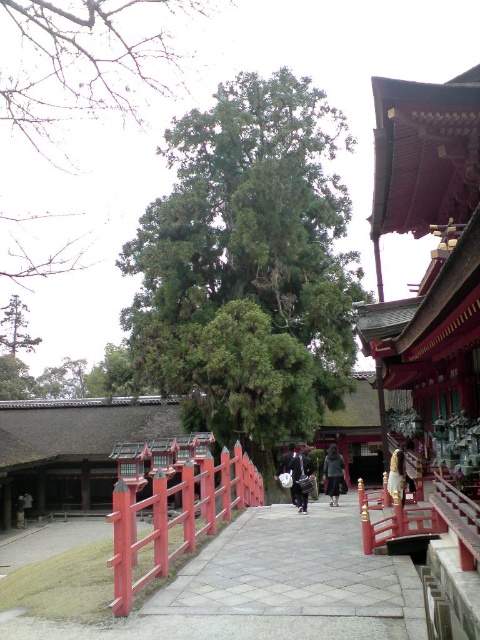
You are a visitor at the shrine and you see the dark blue fabric bag at center and the dark gray fabric pants at center. Which item is narrower in width?

The dark blue fabric bag at center has a lesser width compared to dark gray fabric pants at center, so the dark blue fabric bag at center is narrower.

You are standing at the entrance of the shrine and see two points marked on the ground ahead of you. The first point is at coordinate point [399,598] and the second is at point [308,451]. Which point is closer to you?

Point [399,598] is in front of point [308,451], so the first point is closer to you.

You are visiting a traditional Japanese shrine and see the dark blue fabric bag at center. Where would you find this bag in relation to the large green tree dominating the center of the frame?

The dark blue fabric bag at center is located at point 0.750 on the x axis and 0.629 on the y axis relative to the large green tree dominating the center of the frame.